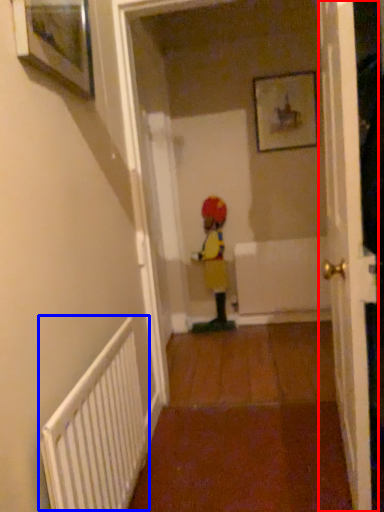
Question: Which of the following is the farthest to the observer, door (highlighted by a red box) or radiator (highlighted by a blue box)?

Choices:
 (A) door
 (B) radiator

Answer: (A)